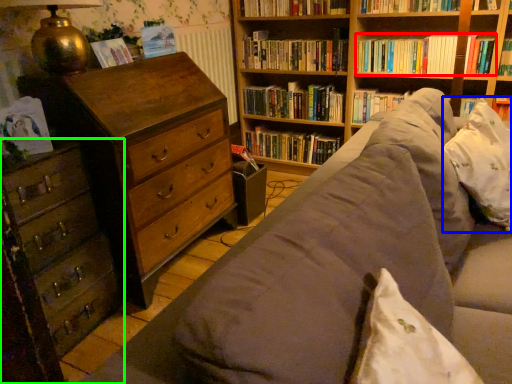
Question: Which object is positioned closest to book (highlighted by a red box)? Select from pillow (highlighted by a blue box) and chest of drawers (highlighted by a green box).

Choices:
 (A) pillow
 (B) chest of drawers

Answer: (A)